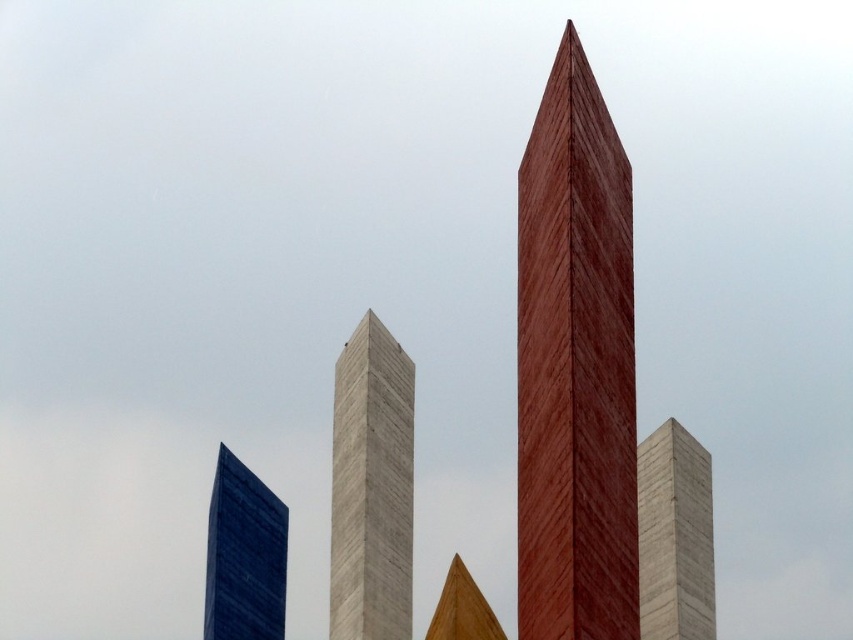
Question: Where is blue glass tower at lower left located in relation to wooden pyramid at center in the image?

Choices:
 (A) above
 (B) below

Answer: (B)

Question: Which point is closer to the camera?

Choices:
 (A) (448, 568)
 (B) (258, 509)

Answer: (B)

Question: Can you confirm if gray marble tower at center is positioned to the left of wooden pyramid at center?

Choices:
 (A) no
 (B) yes

Answer: (A)

Question: Can you confirm if wooden obelisk at center is smaller than blue glass tower at lower left?

Choices:
 (A) yes
 (B) no

Answer: (B)

Question: Among these objects, which one is farthest from the camera?

Choices:
 (A) gray marble tower at center
 (B) gray concrete tower at center
 (C) wooden pyramid at center

Answer: (A)

Question: Which object appears farthest from the camera in this image?

Choices:
 (A) wooden pyramid at center
 (B) blue glass tower at lower left
 (C) gray concrete tower at center

Answer: (B)